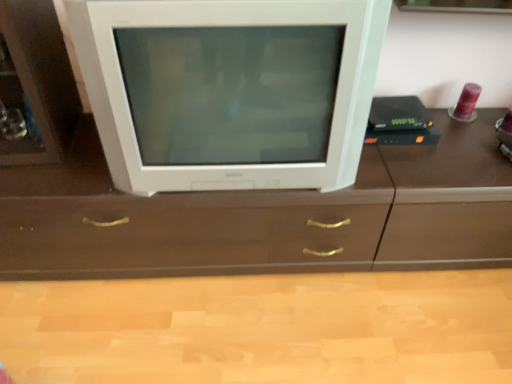
Question: From the image's perspective, relative to white glossy television at center, is brown wood counter top at center above or below?

Choices:
 (A) below
 (B) above

Answer: (A)

Question: From a real-world perspective, is brown wood counter top at center physically located above or below white glossy television at center?

Choices:
 (A) above
 (B) below

Answer: (B)

Question: Is brown wood counter top at center in front of or behind white glossy television at center in the image?

Choices:
 (A) front
 (B) behind

Answer: (B)

Question: From the image's perspective, is white glossy television at center above or below brown wood counter top at center?

Choices:
 (A) above
 (B) below

Answer: (A)

Question: From a real-world perspective, is white glossy television at center positioned above or below brown wood counter top at center?

Choices:
 (A) below
 (B) above

Answer: (B)

Question: Considering the positions of point (183, 66) and point (384, 281), is point (183, 66) closer or farther from the camera than point (384, 281)?

Choices:
 (A) closer
 (B) farther

Answer: (A)

Question: Do you think white glossy television at center is within brown wood counter top at center, or outside of it?

Choices:
 (A) outside
 (B) inside

Answer: (A)